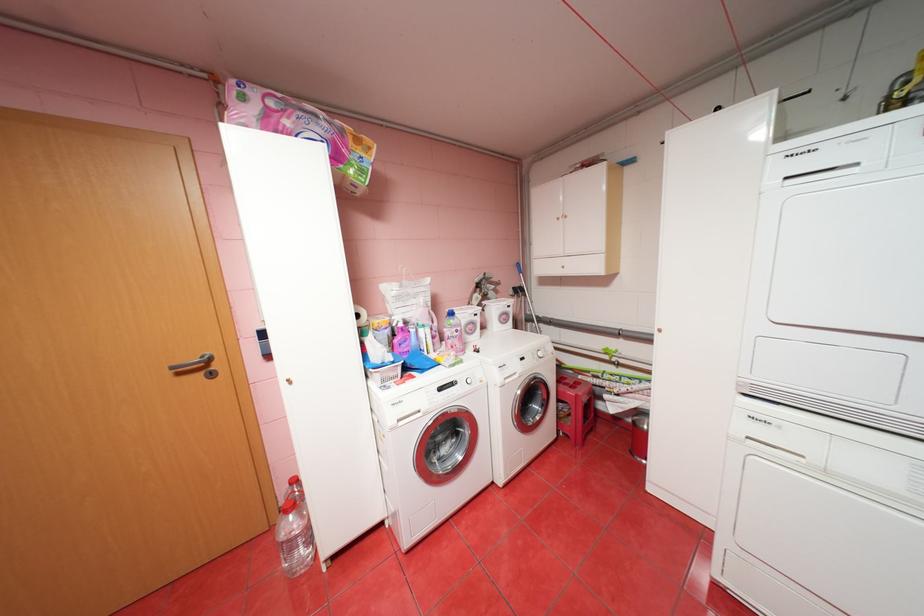
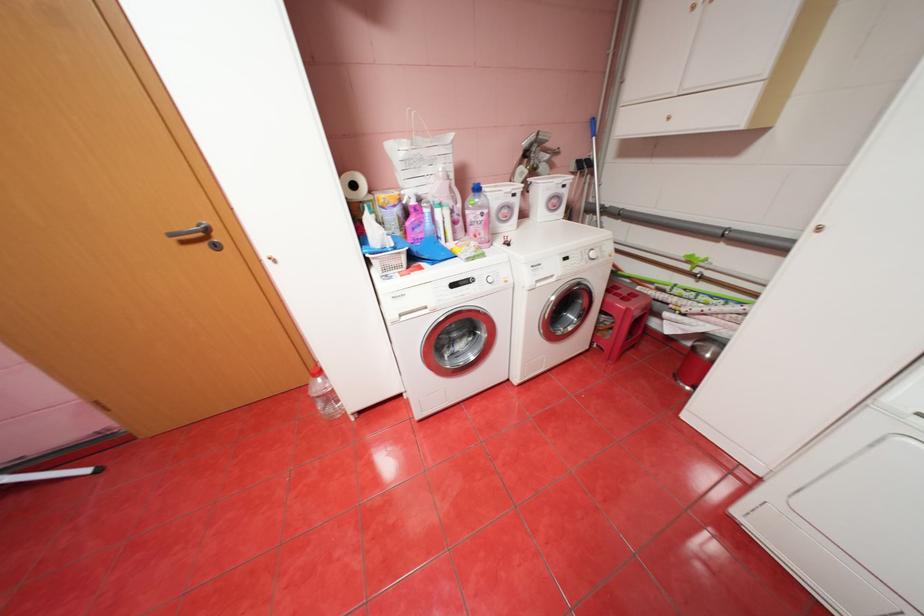
Where in the second image is the point corresponding to [549,353] from the first image?

(602, 254)